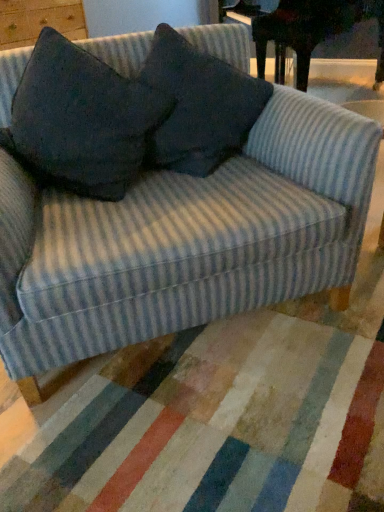
Question: Does dark wood piano at upper right have a lesser width compared to dark fabric pillow at center, which is the second throw pillow from left to right?

Choices:
 (A) no
 (B) yes

Answer: (A)

Question: From the image's perspective, would you say dark wood piano at upper right is shown under dark fabric pillow at center, which is the second throw pillow from left to right?

Choices:
 (A) no
 (B) yes

Answer: (A)

Question: Does dark wood piano at upper right have a greater width compared to dark fabric pillow at center, which is the 1th throw pillow from right to left?

Choices:
 (A) yes
 (B) no

Answer: (A)

Question: Is dark wood piano at upper right looking in the opposite direction of dark fabric pillow at center, which is the second throw pillow from left to right?

Choices:
 (A) no
 (B) yes

Answer: (A)

Question: From a real-world perspective, is dark wood piano at upper right positioned under dark fabric pillow at center, which is the 1th throw pillow from right to left, based on gravity?

Choices:
 (A) no
 (B) yes

Answer: (B)

Question: From a real-world perspective, is dark wood piano at upper right positioned over dark fabric pillow at center, which is the 1th throw pillow from right to left, based on gravity?

Choices:
 (A) yes
 (B) no

Answer: (B)

Question: Is dark gray fabric pillow at upper center, which is counted as the 1th throw pillow, starting from the left, touching dark fabric pillow at center, which is the second throw pillow from left to right?

Choices:
 (A) yes
 (B) no

Answer: (B)

Question: From a real-world perspective, is dark gray fabric pillow at upper center, which appears as the 2th throw pillow when viewed from the right, below dark fabric pillow at center, which is the second throw pillow from left to right?

Choices:
 (A) yes
 (B) no

Answer: (B)

Question: Is there a large distance between dark gray fabric pillow at upper center, which appears as the 2th throw pillow when viewed from the right, and dark fabric pillow at center, which is the 1th throw pillow from right to left?

Choices:
 (A) yes
 (B) no

Answer: (B)

Question: Does dark gray fabric pillow at upper center, which appears as the 2th throw pillow when viewed from the right, have a lesser height compared to dark fabric pillow at center, which is the second throw pillow from left to right?

Choices:
 (A) yes
 (B) no

Answer: (B)

Question: Does dark gray fabric pillow at upper center, which is counted as the 1th throw pillow, starting from the left, have a larger size compared to dark fabric pillow at center, which is the 1th throw pillow from right to left?

Choices:
 (A) yes
 (B) no

Answer: (A)

Question: From the image's perspective, would you say dark gray fabric pillow at upper center, which is counted as the 1th throw pillow, starting from the left, is positioned over dark fabric pillow at center, which is the second throw pillow from left to right?

Choices:
 (A) yes
 (B) no

Answer: (B)

Question: Is the depth of dark fabric pillow at center, which is the 1th throw pillow from right to left, greater than that of dark gray fabric pillow at upper center, which is counted as the 1th throw pillow, starting from the left?

Choices:
 (A) yes
 (B) no

Answer: (A)